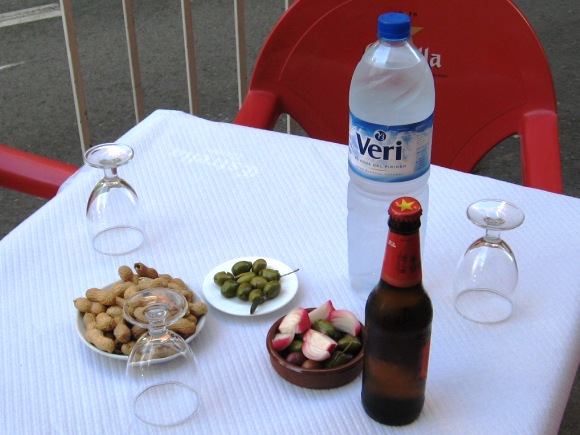
Locate an element on the screen. Image resolution: width=580 pixels, height=435 pixels. table top is located at coordinates (462, 355).